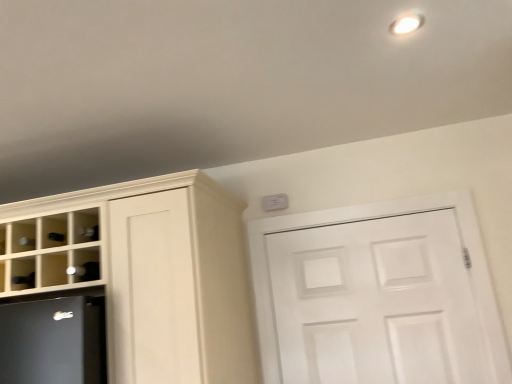
Question: Should I look upward or downward to see white matte door at upper center?

Choices:
 (A) up
 (B) down

Answer: (B)